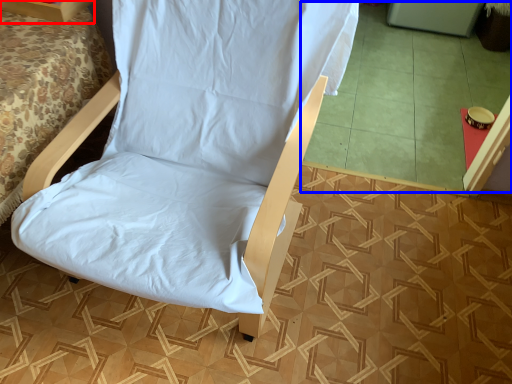
Question: Which object is further to the camera taking this photo, furniture (highlighted by a red box) or tile (highlighted by a blue box)?

Choices:
 (A) furniture
 (B) tile

Answer: (B)